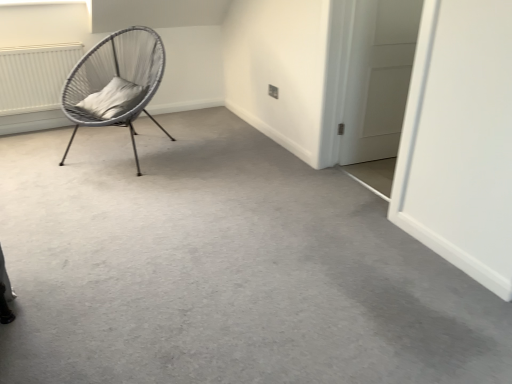
The height and width of the screenshot is (384, 512). What do you see at coordinates (115, 83) in the screenshot? I see `woven grey chair at left` at bounding box center [115, 83].

What is the approximate height of white soft cushion at left?

white soft cushion at left is 7.98 inches in height.

I want to click on gray carpet at center, so click(x=223, y=268).

From a real-world perspective, which object rests below the other?

white textured radiator at upper left, from a real-world perspective.

Is there a large distance between white textured radiator at upper left and woven grey chair at left?

No, white textured radiator at upper left is not far away from woven grey chair at left.

Between point (26, 87) and point (138, 61), which one is positioned in front?

Positioned in front is point (138, 61).

In terms of width, does white textured radiator at upper left look wider or thinner when compared to woven grey chair at left?

Considering their sizes, white textured radiator at upper left looks slimmer than woven grey chair at left.

Is gray carpet at center taller than white textured radiator at upper left?

No, gray carpet at center is not taller than white textured radiator at upper left.

Is there a large distance between gray carpet at center and white textured radiator at upper left?

Yes, gray carpet at center and white textured radiator at upper left are quite far apart.

Would you say gray carpet at center contains white textured radiator at upper left?

No, gray carpet at center does not contain white textured radiator at upper left.

I want to click on radiator on the left of gray carpet at center, so click(x=35, y=76).

Are white matte door at right and woven grey chair at left far apart?

That's right, there is a large distance between white matte door at right and woven grey chair at left.

Is white matte door at right facing towards woven grey chair at left?

No, white matte door at right is not oriented towards woven grey chair at left.

In the image, is white matte door at right positioned in front of or behind woven grey chair at left?

white matte door at right is behind woven grey chair at left.

Considering the relative positions of white matte door at right and woven grey chair at left in the image provided, is white matte door at right to the left of woven grey chair at left from the viewer's perspective?

Incorrect, white matte door at right is not on the left side of woven grey chair at left.

Based on the photo, can you tell me how much white matte door at right and gray carpet at center differ in facing direction?

white matte door at right and gray carpet at center are facing 175 degrees away from each other.

Would you say white matte door at right contains gray carpet at center?

No, gray carpet at center is not inside white matte door at right.

Is point (373, 116) less distant than point (294, 208)?

No.

From the image's perspective, which is below, white matte door at right or gray carpet at center?

gray carpet at center is shown below in the image.

This screenshot has height=384, width=512. I want to click on pillow on the right of white textured radiator at upper left, so click(112, 100).

From the picture: Looking at their sizes, would you say white textured radiator at upper left is wider or thinner than white soft cushion at left?

In the image, white textured radiator at upper left appears to be more narrow than white soft cushion at left.

Who is taller, white textured radiator at upper left or white soft cushion at left?

With more height is white textured radiator at upper left.

Which is in front, point (51, 58) or point (117, 80)?

The point (117, 80) is closer.

Is white soft cushion at left at the left side of gray carpet at center?

Indeed, white soft cushion at left is positioned on the left side of gray carpet at center.

Is white soft cushion at left far away from gray carpet at center?

Yes, white soft cushion at left is far from gray carpet at center.

Is white soft cushion at left facing away from gray carpet at center?

No, white soft cushion at left is not facing the opposite direction of gray carpet at center.

From the image's perspective, is white soft cushion at left positioned above or below gray carpet at center?

white soft cushion at left is above gray carpet at center.

Considering the positions of points (103, 115) and (136, 187), is point (103, 115) closer to camera compared to point (136, 187)?

No, (103, 115) is behind (136, 187).

Is woven grey chair at left facing away from gray carpet at center?

No.

Based on their positions, is woven grey chair at left located to the left or right of gray carpet at center?

woven grey chair at left is to the left of gray carpet at center.

Are woven grey chair at left and gray carpet at center making contact?

woven grey chair at left and gray carpet at center are not in contact.

Where is `radiator lying behind the woven grey chair at left`? The image size is (512, 384). radiator lying behind the woven grey chair at left is located at coordinates (35, 76).

Where is `concrete below the white textured radiator at upper left (from the image's perspective)`? This screenshot has height=384, width=512. concrete below the white textured radiator at upper left (from the image's perspective) is located at coordinates (223, 268).

Which object lies nearer to the anchor point white soft cushion at left, woven grey chair at left or white matte door at right?

Among the two, woven grey chair at left is located nearer to white soft cushion at left.

Estimate the real-world distances between objects in this image. Which object is further from woven grey chair at left, gray carpet at center or white matte door at right?

white matte door at right is positioned further to the anchor woven grey chair at left.

Based on the photo, when comparing their distances from woven grey chair at left, does white soft cushion at left or gray carpet at center seem closer?

white soft cushion at left lies closer to woven grey chair at left than the other object.

From the image, which object appears to be nearer to white matte door at right, white textured radiator at upper left or woven grey chair at left?

woven grey chair at left is closer to white matte door at right.

Looking at the image, which one is located further to white textured radiator at upper left, white matte door at right or woven grey chair at left?

Based on the image, white matte door at right appears to be further to white textured radiator at upper left.

Considering their positions, is woven grey chair at left positioned closer to white soft cushion at left than gray carpet at center?

woven grey chair at left.

Considering their positions, is white textured radiator at upper left positioned closer to woven grey chair at left than gray carpet at center?

Based on the image, white textured radiator at upper left appears to be nearer to woven grey chair at left.

In the scene shown: Looking at the image, which one is located further to woven grey chair at left, white textured radiator at upper left or white matte door at right?

white matte door at right.

You are a GUI agent. You are given a task and a screenshot of the screen. Output one action in this format:
    pyautogui.click(x=<x>, y=<y>)
    Task: Click on the chair between gray carpet at center and white soft cushion at left from front to back
    This screenshot has height=384, width=512.
    Given the screenshot: What is the action you would take?
    pyautogui.click(x=115, y=83)

Locate an element on the screen. This screenshot has width=512, height=384. pillow between white textured radiator at upper left and white matte door at right in the horizontal direction is located at coordinates (112, 100).

Identify the location of pillow between gray carpet at center and white textured radiator at upper left in the front-back direction. The height and width of the screenshot is (384, 512). (112, 100).

The image size is (512, 384). Identify the location of chair between white textured radiator at upper left and white matte door at right from left to right. [115, 83].